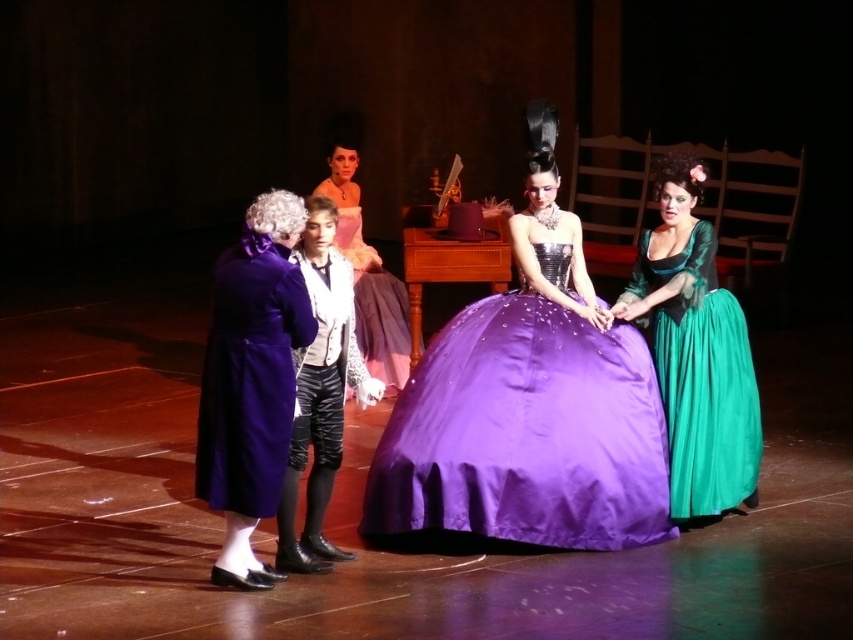
You are an actor on stage and need to find your prop. The prop is located at point (x=320, y=394). Which object is at that point?

The leather pants at center is located at point (x=320, y=394).

You are an actor standing on the stage and need to move from the point marked as point (483, 378) to the point marked as point (294, 253). Which direction should you move to reach your destination?

To move from point (483, 378) to point (294, 253), you should move diagonally towards the upper left direction since point (483, 378) is behind point (294, 253).